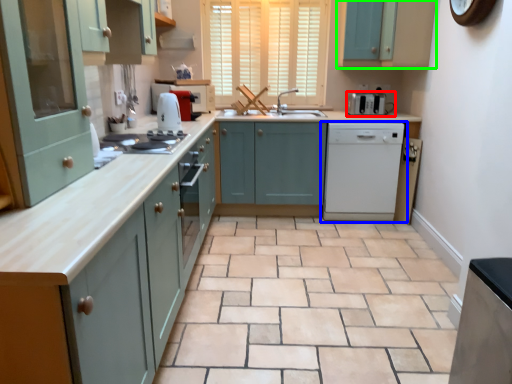
Question: Based on their relative distances, which object is nearer to home appliance (highlighted by a red box)? Choose from home appliance (highlighted by a blue box) and cabinetry (highlighted by a green box).

Choices:
 (A) home appliance
 (B) cabinetry

Answer: (A)